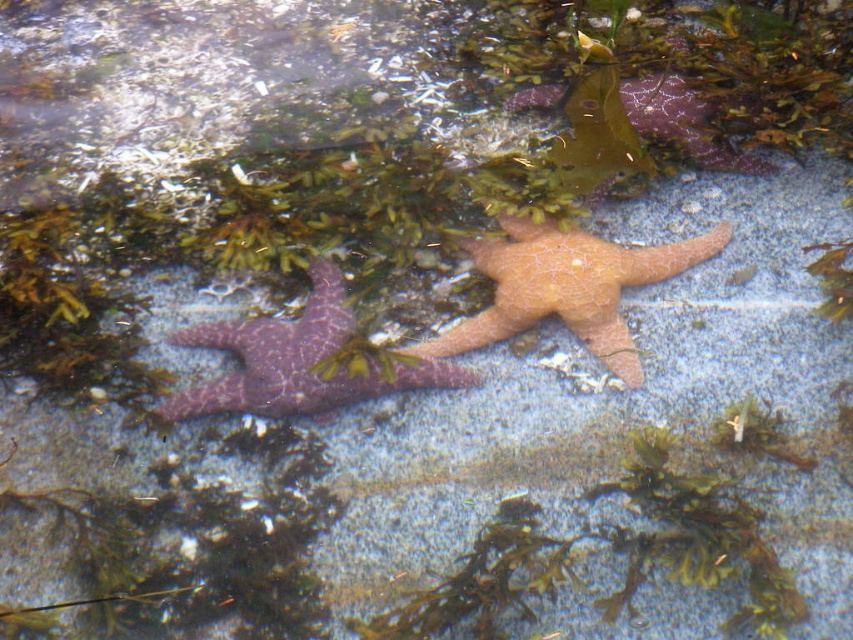
Who is positioned more to the right, orange matte starfish at center or purple matte starfish at center?

Positioned to the right is orange matte starfish at center.

Between point (485, 257) and point (428, 364), which one is positioned behind?

Positioned behind is point (485, 257).

Is point (469, 323) in front of point (323, 314)?

No, (469, 323) is further to viewer.

Identify the location of orange matte starfish at center. (566, 288).